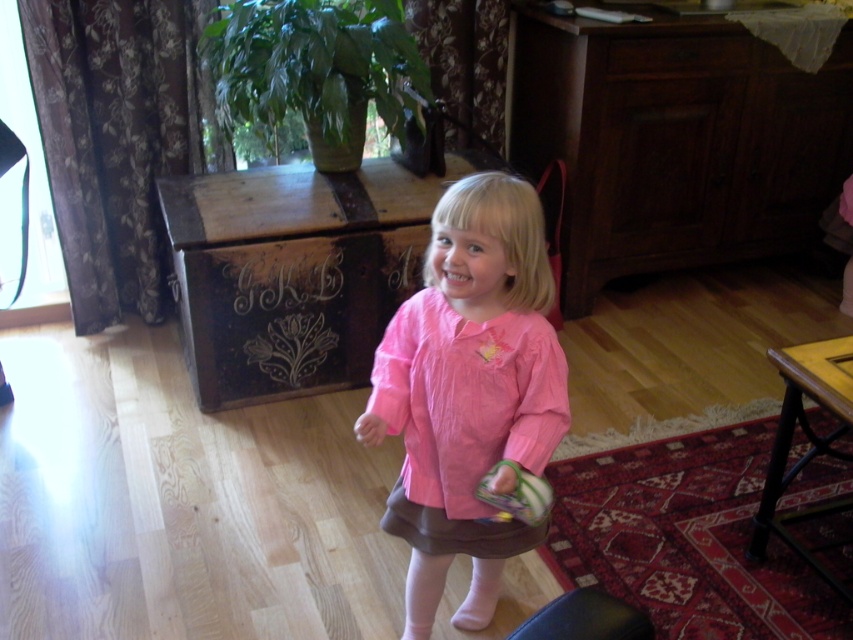
You are a parent looking for your child to wear the pink satin dress at center. The child is currently standing near the plush green toy at lower center. Which direction should you guide the child to move to reach the dress?

The pink satin dress at center is to the left of the plush green toy at lower center, so you should guide the child to move to the left to reach the dress.

Looking at this image, you are a parent who wants to place a small gift box between the pink satin dress at center and the plush green toy at lower center. The gift box is 9 inches long. Will it fit between them?

The distance between the pink satin dress at center and the plush green toy at lower center is 8.20 inches. Since the gift box is 9 inches long, it will not fit between them as it is longer than the available space.